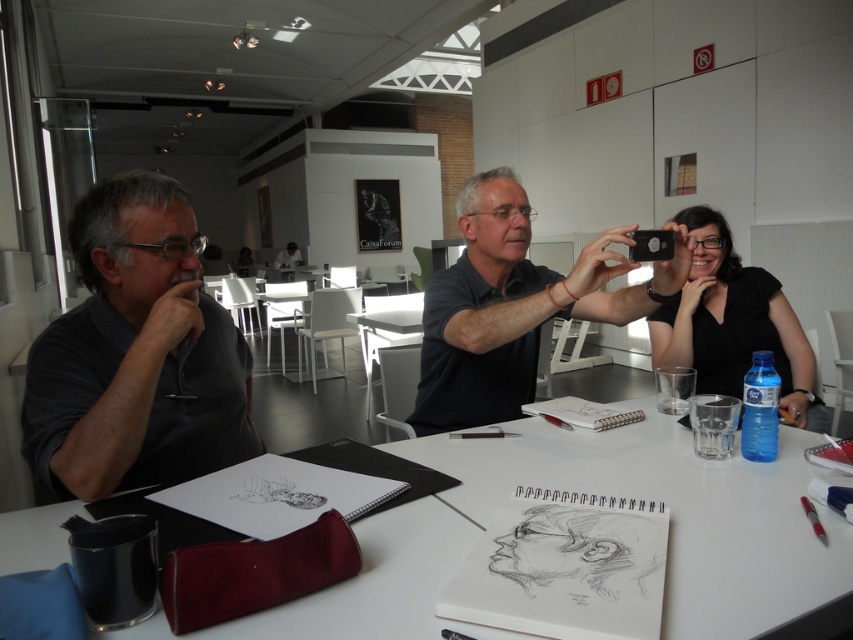
You are a guest at this table and want to place a small coffee cup on the white paper at center without it touching the dark gray shirt at left. Is there enough space?

The white paper at center is positioned under dark gray shirt at left, so placing a small coffee cup on the white paper at center might be possible, but the dark gray shirt at left is directly above it. Ensure the cup is placed away from the area under the shirt to avoid contact.

You are a photographer standing at a distance and want to capture a closeup of the white paper at center without moving the camera. Can you achieve this using a zoom lens with a maximum focal length of 200mm?

The white paper at center is 28.68 inches away from the camera. With a zoom lens of 200mm, you can adjust the focal length to magnify the subject sufficiently for a closeup without moving the camera.

You are an artist who needs to place a new sketch on the table. You have a white paper at center and a matte black phone at center. Which object should you move to make space, and why?

You should move the matte black phone at center because the white paper at center is closer to the viewer, making it the better surface for placing your new sketch without obstructing the phone.